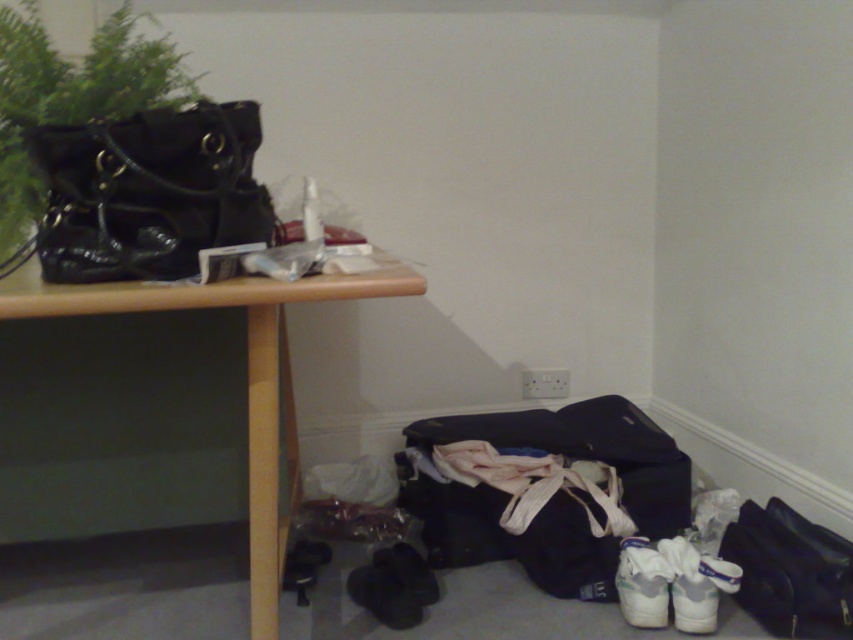
You are organizing the items in the room and need to place a new object between the wooden table at upper left and the green matte plant at upper left. Is there enough space between them to fit a 10 cm wide decorative vase?

The wooden table at upper left is positioned on the right side of the green matte plant at upper left. However, the exact distance between them isn not specified in the provided description. Without knowing the space between them, it is impossible to determine if the 10 cm wide decorative vase will fit.

You are a delivery person who needs to place a large package on the wooden table at upper left and the green matte plant at upper left. Which object has enough space to accommodate the package?

The wooden table at upper left is bigger than the green matte plant at upper left, so the wooden table at upper left has enough space to accommodate the package.